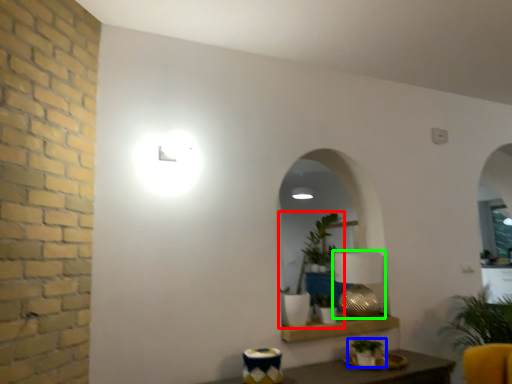
Question: Which object is positioned closest to houseplant (highlighted by a red box)? Select from houseplant (highlighted by a blue box) and table lamp (highlighted by a green box).

Choices:
 (A) houseplant
 (B) table lamp

Answer: (B)